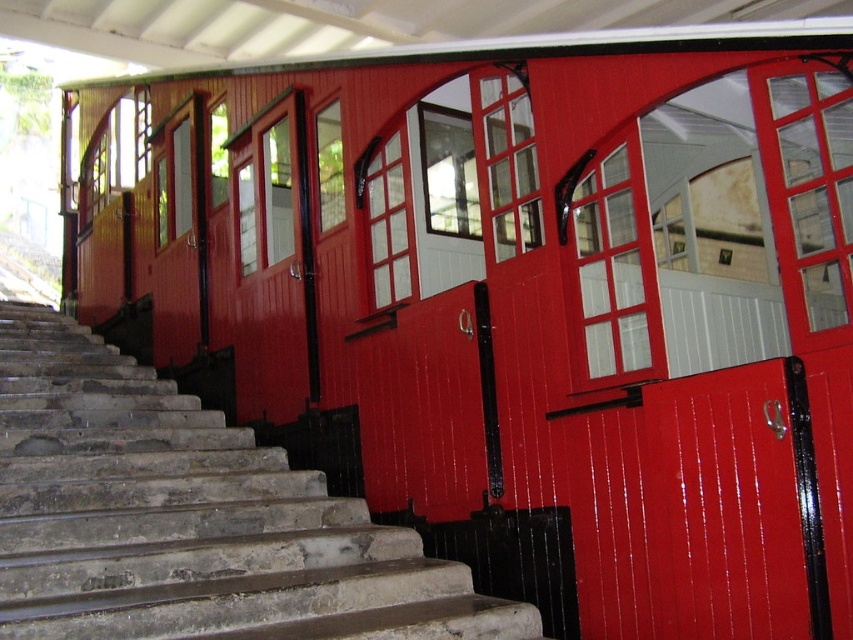
Question: Which point is closer to the camera taking this photo?

Choices:
 (A) (105, 536)
 (B) (764, 376)

Answer: (B)

Question: Is stone stairs at lower left further to camera compared to glossy wood door at center?

Choices:
 (A) no
 (B) yes

Answer: (B)

Question: Does stone stairs at lower left appear on the left side of glossy wood door at center?

Choices:
 (A) yes
 (B) no

Answer: (A)

Question: Can you confirm if stone stairs at lower left is positioned to the right of glossy wood door at center?

Choices:
 (A) no
 (B) yes

Answer: (A)